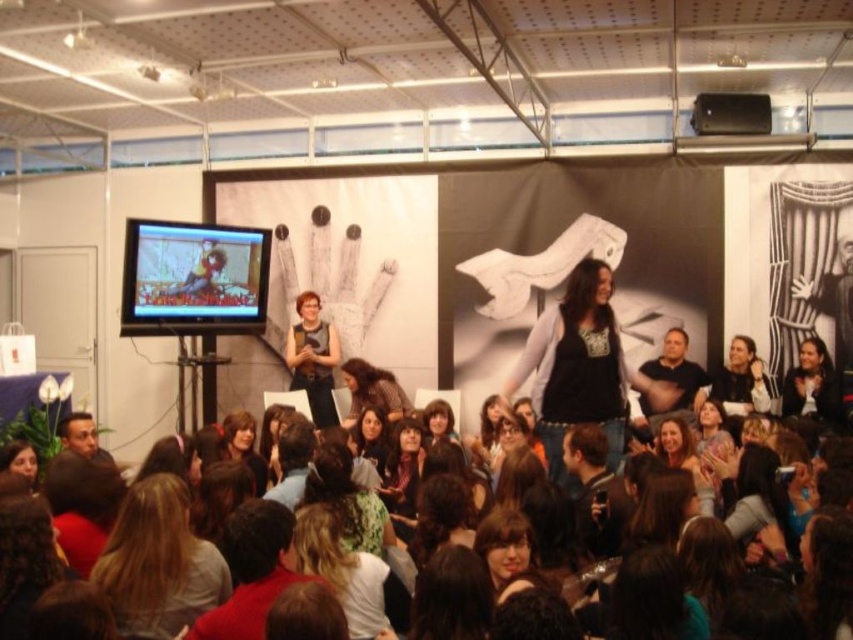
You are standing at the center of the stage and want to check the position of the matte black screen at left. What are its coordinates?

The coordinates of the matte black screen at left are at point (193,278).

You are an attendee at the event and notice the matte black screen at left and the matte black shirt at center. Which object is positioned higher in the image?

The matte black screen at left is positioned higher than the matte black shirt at center.

You are attending an event and want to take a photo of the black cotton shirt at center without the matte black screen at left appearing in the frame. Is this possible?

The matte black screen at left is located above the black cotton shirt at center, so if you position yourself below the screen and aim your camera upwards towards the shirt, you can capture the shirt without the screen in the frame.